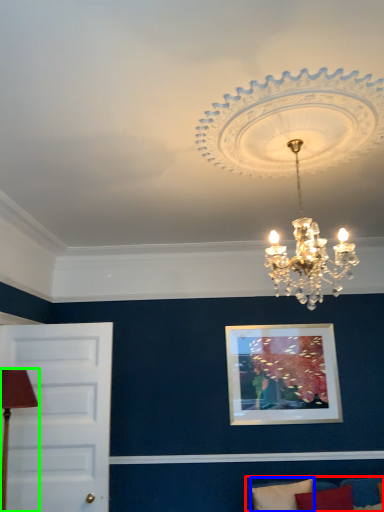
Question: Which object is the closest to the couch (highlighted by a red box)? Choose among these: pillow (highlighted by a blue box) or table lamp (highlighted by a green box).

Choices:
 (A) pillow
 (B) table lamp

Answer: (A)